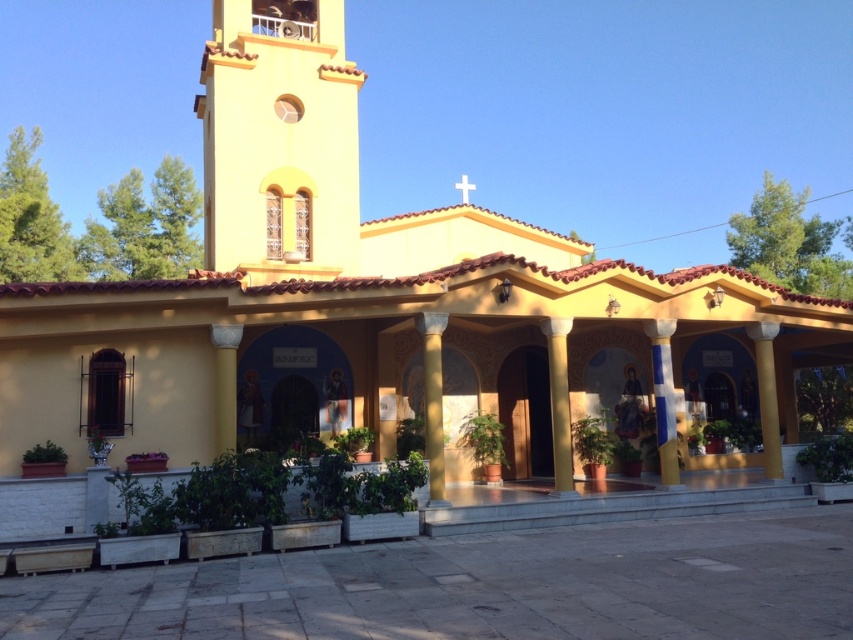
Question: In this image, where is yellow stucco bell tower at upper left located relative to yellow matte column at center?

Choices:
 (A) left
 (B) right

Answer: (A)

Question: Which point is closer to the camera?

Choices:
 (A) (289, 266)
 (B) (424, 385)

Answer: (B)

Question: Among these objects, which one is nearest to the camera?

Choices:
 (A) yellow stucco bell tower at upper left
 (B) yellow matte column at center

Answer: (B)

Question: Is yellow stucco bell tower at upper left wider than yellow matte column at center?

Choices:
 (A) yes
 (B) no

Answer: (A)

Question: Is yellow stucco bell tower at upper left wider than yellow matte column at center?

Choices:
 (A) no
 (B) yes

Answer: (B)